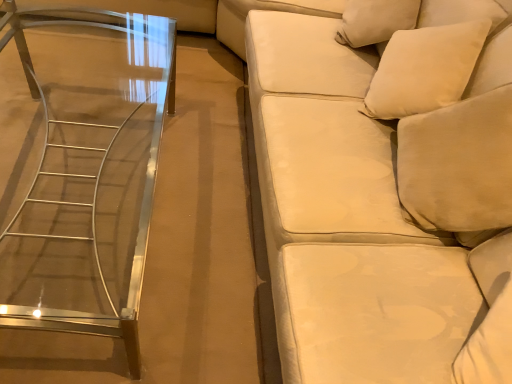
Question: From a real-world perspective, relative to clear glass table at left, is white soft pillow at upper right vertically above or below?

Choices:
 (A) below
 (B) above

Answer: (B)

Question: Considering the positions of point (395, 87) and point (46, 195), is point (395, 87) closer or farther from the camera than point (46, 195)?

Choices:
 (A) farther
 (B) closer

Answer: (B)

Question: Based on their relative distances, which object is nearer to the clear glass table at left?

Choices:
 (A) white soft pillow at upper right
 (B) velvet beige studio couch at right

Answer: (B)

Question: Which object is positioned closest to the clear glass table at left?

Choices:
 (A) velvet beige studio couch at right
 (B) white soft pillow at upper right

Answer: (A)